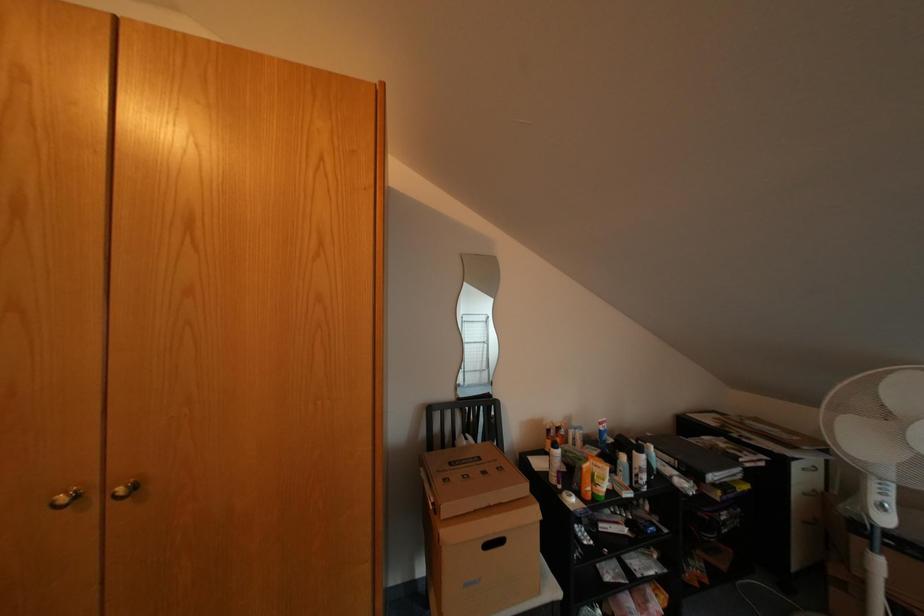
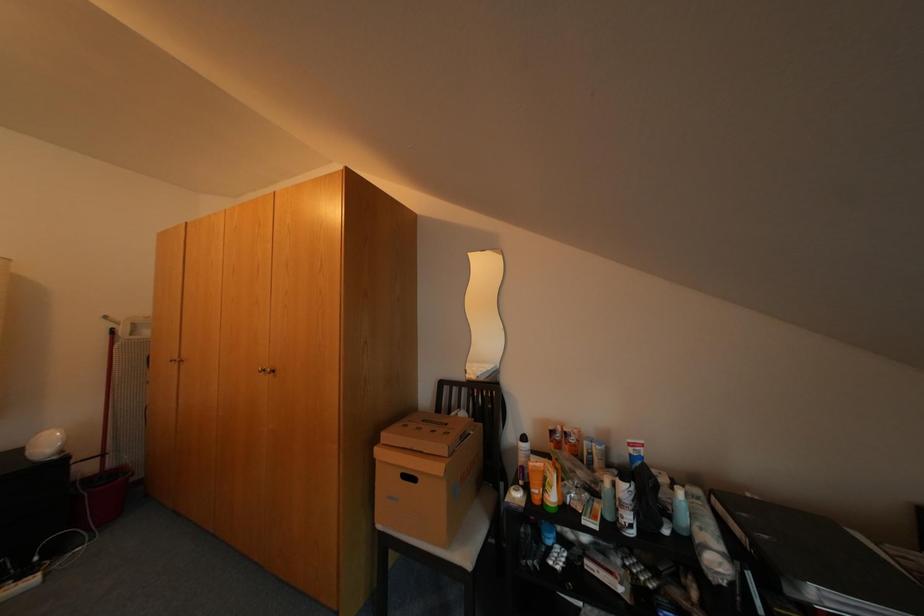
Question: The images are taken continuously from a first-person perspective. In which direction is your viewpoint rotating?

Choices:
 (A) Left
 (B) Right
 (C) Up
 (D) Down

Answer: (A)